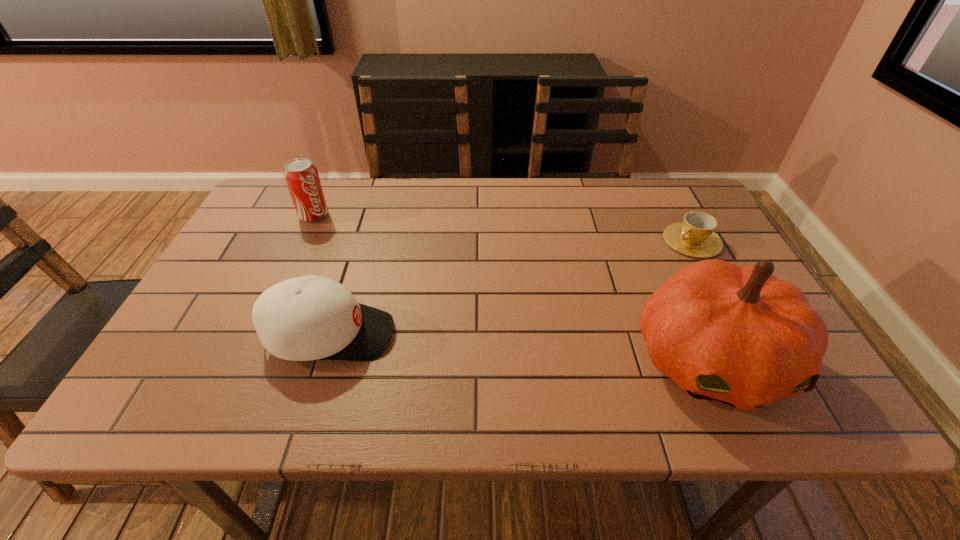
The image size is (960, 540). I want to click on free spot on the desktop that is between the baseball cap and the pumpkin and is positioned on the logo side of the soda can, so click(x=464, y=343).

This screenshot has width=960, height=540. Find the location of `free spot on the desktop that is between the third tallest object and the pumpkin and is positioned with the handle on the side of the cup`. free spot on the desktop that is between the third tallest object and the pumpkin and is positioned with the handle on the side of the cup is located at coordinates (496, 346).